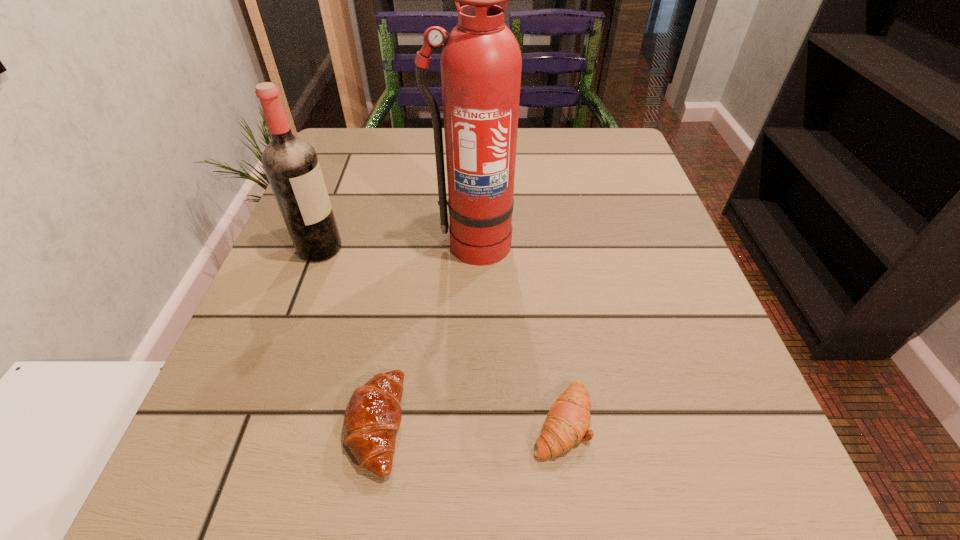
This screenshot has width=960, height=540. I want to click on object that ranks as the second closest to the leftmost object, so click(373, 414).

At what (x,y) coordinates should I click in order to perform the action: click on free space that satisfies the following two spatial constraints: 1. on the front-facing side of the third shortest object; 2. on the right side of the left crescent roll. Please return your answer as a coordinate pair (x, y). Looking at the image, I should click on (254, 424).

The width and height of the screenshot is (960, 540). In order to click on vacant space that satisfies the following two spatial constraints: 1. on the front-facing side of the liquor; 2. on the back side of the taller crescent roll in this screenshot , I will do `click(254, 424)`.

Where is `free spot that satisfies the following two spatial constraints: 1. on the front-facing side of the taller crescent roll; 2. on the left side of the second tallest object`? free spot that satisfies the following two spatial constraints: 1. on the front-facing side of the taller crescent roll; 2. on the left side of the second tallest object is located at coordinates (254, 424).

The image size is (960, 540). Identify the location of free space that satisfies the following two spatial constraints: 1. on the label side of the third object from left to right; 2. on the front-facing side of the leftmost object. (472, 248).

Locate an element on the screen. The height and width of the screenshot is (540, 960). free space that satisfies the following two spatial constraints: 1. on the label side of the shorter crescent roll; 2. on the right side of the third object from left to right is located at coordinates (468, 421).

Where is `vacant space that satisfies the following two spatial constraints: 1. on the front-facing side of the liquor; 2. on the right side of the third tallest object`? vacant space that satisfies the following two spatial constraints: 1. on the front-facing side of the liquor; 2. on the right side of the third tallest object is located at coordinates (254, 424).

You are a GUI agent. You are given a task and a screenshot of the screen. Output one action in this format:
    pyautogui.click(x=<x>, y=<y>)
    Task: Click on the vacant space that satisfies the following two spatial constraints: 1. on the front-facing side of the second tallest object; 2. on the right side of the shortest object
    
    Given the screenshot: What is the action you would take?
    pyautogui.click(x=255, y=421)

Find the location of `free space that satisfies the following two spatial constraints: 1. on the back side of the right crescent roll; 2. on the left side of the second object from left to right`. free space that satisfies the following two spatial constraints: 1. on the back side of the right crescent roll; 2. on the left side of the second object from left to right is located at coordinates (376, 421).